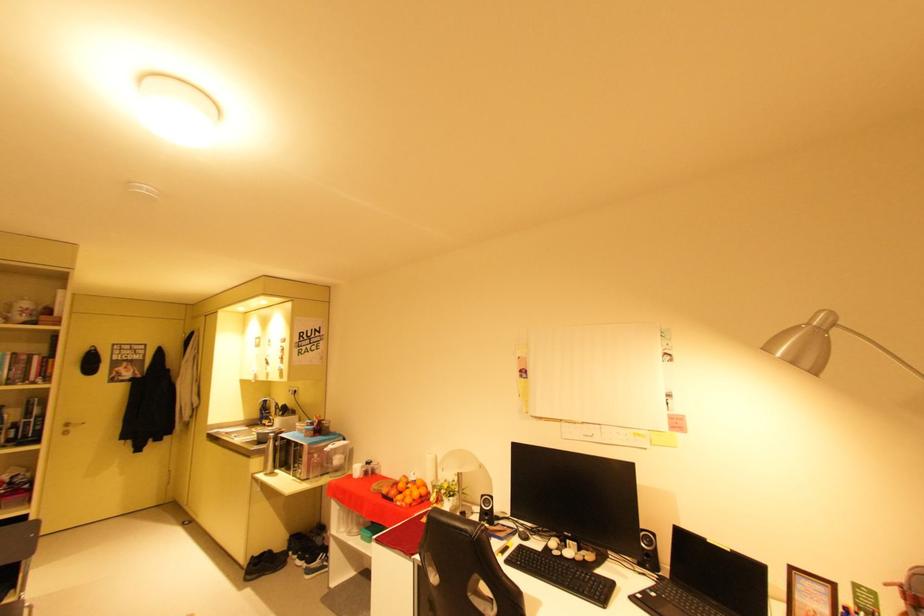
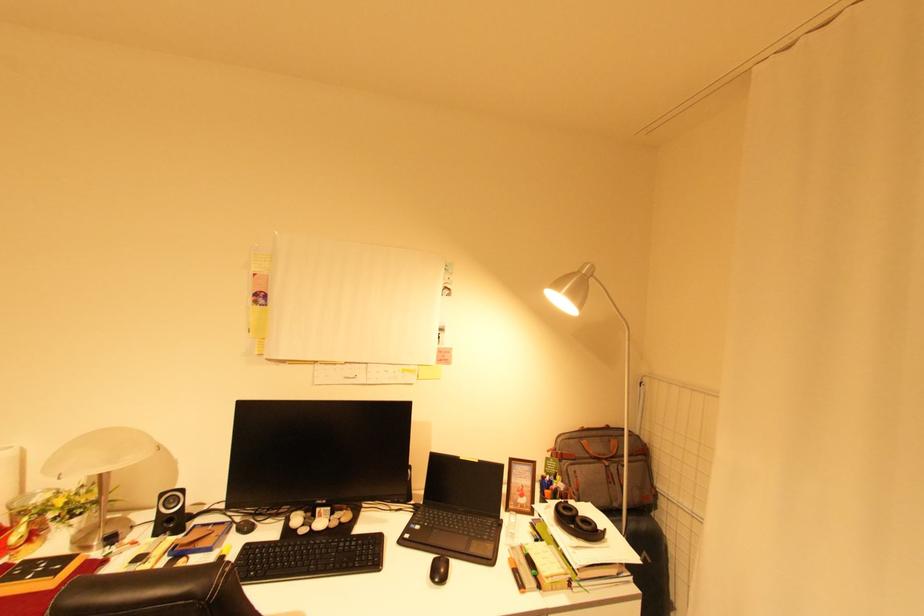
Question: The camera is either moving clockwise (left) or counter-clockwise (right) around the object. The first image is from the beginning of the video and the second image is from the end. Is the camera moving left or right when shooting the video?

Choices:
 (A) Left
 (B) Right

Answer: (A)